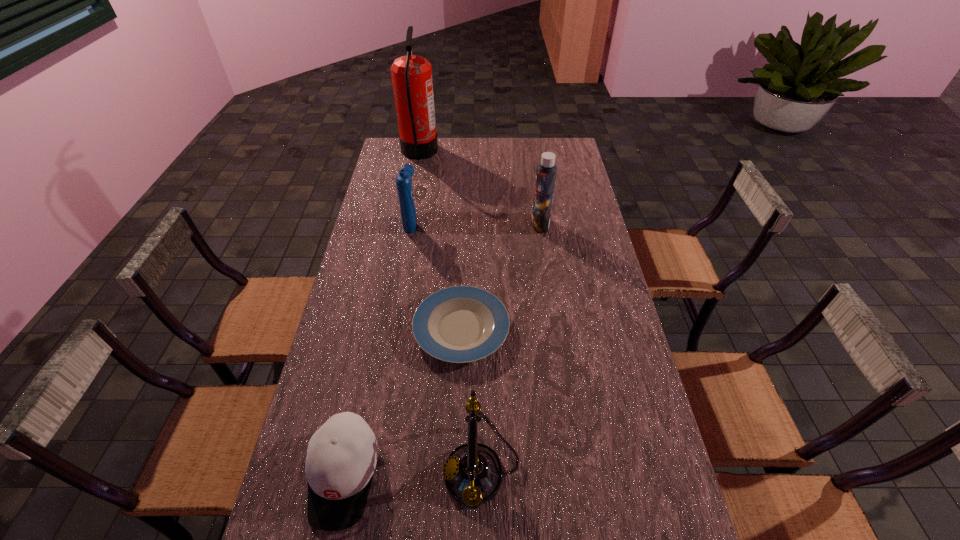
Identify the location of the farthest object. This screenshot has width=960, height=540. (411, 75).

Image resolution: width=960 pixels, height=540 pixels. What are the coordinates of `fire extinguisher` in the screenshot? It's located at (411, 75).

At what (x,y) coordinates should I click in order to perform the action: click on the right shampoo. Please return your answer as a coordinate pair (x, y). This screenshot has height=540, width=960. Looking at the image, I should click on [x=546, y=172].

The height and width of the screenshot is (540, 960). What are the coordinates of `the fifth shortest object` in the screenshot? It's located at (546, 172).

You are a GUI agent. You are given a task and a screenshot of the screen. Output one action in this format:
    pyautogui.click(x=<x>, y=<y>)
    Task: Click on the left shampoo
    
    Given the screenshot: What is the action you would take?
    pyautogui.click(x=403, y=179)

Identify the location of the third tallest object. The width and height of the screenshot is (960, 540). (403, 179).

The width and height of the screenshot is (960, 540). I want to click on telephone, so click(x=473, y=473).

This screenshot has width=960, height=540. I want to click on baseball cap, so point(341,458).

Find the location of a particular element. The height and width of the screenshot is (540, 960). plate is located at coordinates (460, 324).

Find the location of `the shortest object`. the shortest object is located at coordinates (460, 324).